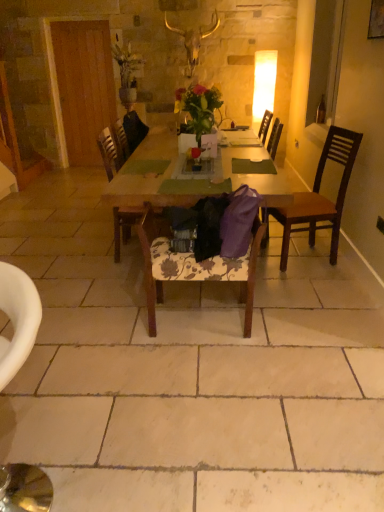
This screenshot has height=512, width=384. In order to click on vacant space to the right of floral fabric chair at center, the second chair viewed from the right in this screenshot , I will do `click(288, 322)`.